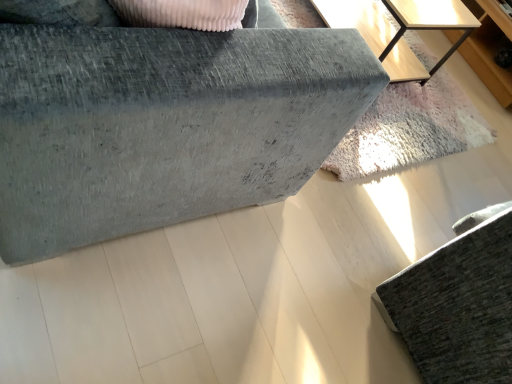
Question: Is light wood table at upper right positioned behind textured gray sofa at lower right, acting as the 2th furniture starting from the left?

Choices:
 (A) yes
 (B) no

Answer: (A)

Question: Is light wood table at upper right far from textured gray sofa at lower right, acting as the 2th furniture starting from the left?

Choices:
 (A) no
 (B) yes

Answer: (B)

Question: From a real-world perspective, is light wood table at upper right on top of textured gray sofa at lower right, acting as the 2th furniture starting from the left?

Choices:
 (A) no
 (B) yes

Answer: (A)

Question: Is light wood table at upper right thinner than textured gray sofa at lower right, acting as the 2th furniture starting from the left?

Choices:
 (A) no
 (B) yes

Answer: (B)

Question: Considering the relative sizes of light wood table at upper right and textured gray sofa at lower right, the 1th furniture positioned from the right, in the image provided, is light wood table at upper right smaller than textured gray sofa at lower right, the 1th furniture positioned from the right,?

Choices:
 (A) no
 (B) yes

Answer: (B)

Question: Is light wood dresser at upper right situated inside light wood table at upper right or outside?

Choices:
 (A) inside
 (B) outside

Answer: (B)

Question: In terms of height, does light wood dresser at upper right look taller or shorter compared to light wood table at upper right?

Choices:
 (A) tall
 (B) short

Answer: (B)

Question: Relative to light wood table at upper right, is light wood dresser at upper right in front or behind?

Choices:
 (A) behind
 (B) front

Answer: (A)

Question: From a real-world perspective, relative to light wood table at upper right, is light wood dresser at upper right vertically above or below?

Choices:
 (A) below
 (B) above

Answer: (A)

Question: Do you think velvet grey sofa at upper left, the first furniture from the left, is within light wood table at upper right, or outside of it?

Choices:
 (A) outside
 (B) inside

Answer: (A)

Question: Is velvet grey sofa at upper left, the first furniture from the left, taller or shorter than light wood table at upper right?

Choices:
 (A) tall
 (B) short

Answer: (A)

Question: Is point [337, 82] closer or farther from the camera than point [454, 23]?

Choices:
 (A) farther
 (B) closer

Answer: (B)

Question: In the image, is velvet grey sofa at upper left, the first furniture from the left, positioned in front of or behind light wood table at upper right?

Choices:
 (A) front
 (B) behind

Answer: (A)

Question: Is textured gray sofa at lower right, acting as the 2th furniture starting from the left, taller or shorter than light wood table at upper right?

Choices:
 (A) tall
 (B) short

Answer: (A)

Question: From the image's perspective, is textured gray sofa at lower right, acting as the 2th furniture starting from the left, positioned above or below light wood table at upper right?

Choices:
 (A) below
 (B) above

Answer: (A)